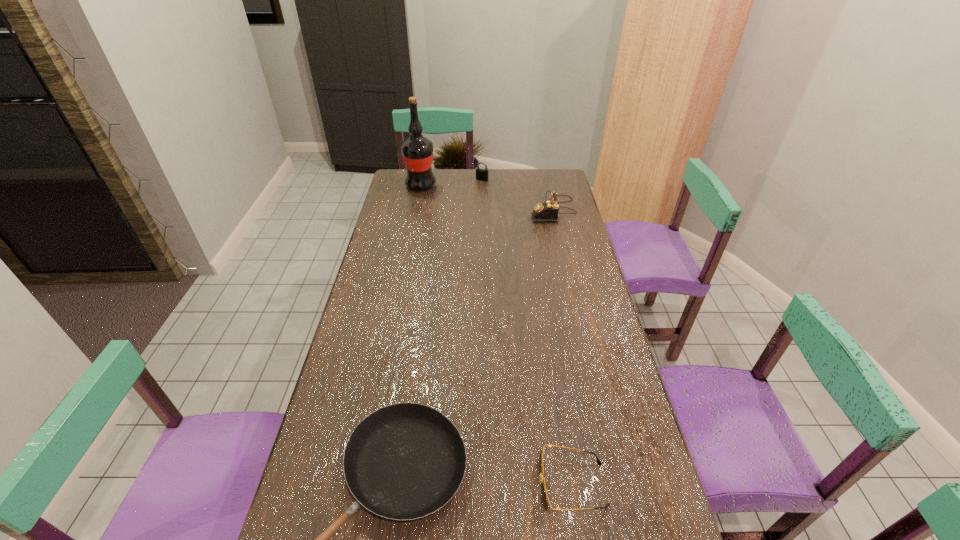
Where is `vacant space in between the fourth shortest object and the wine bottle`? This screenshot has width=960, height=540. vacant space in between the fourth shortest object and the wine bottle is located at coordinates (487, 198).

Image resolution: width=960 pixels, height=540 pixels. What are the coordinates of `vacant space that's between the third nearest object and the padlock` in the screenshot? It's located at (517, 195).

The height and width of the screenshot is (540, 960). Find the location of `object that is the closest to the frying pan`. object that is the closest to the frying pan is located at coordinates click(545, 499).

Locate an element on the screen. object that can be found as the second closest to the sunglasses is located at coordinates (548, 211).